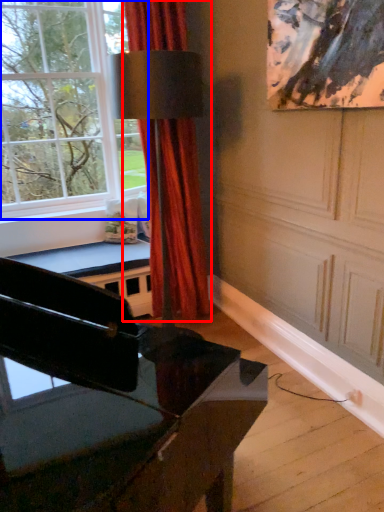
Question: Among these objects, which one is farthest to the camera, curtain (highlighted by a red box) or window (highlighted by a blue box)?

Choices:
 (A) curtain
 (B) window

Answer: (A)